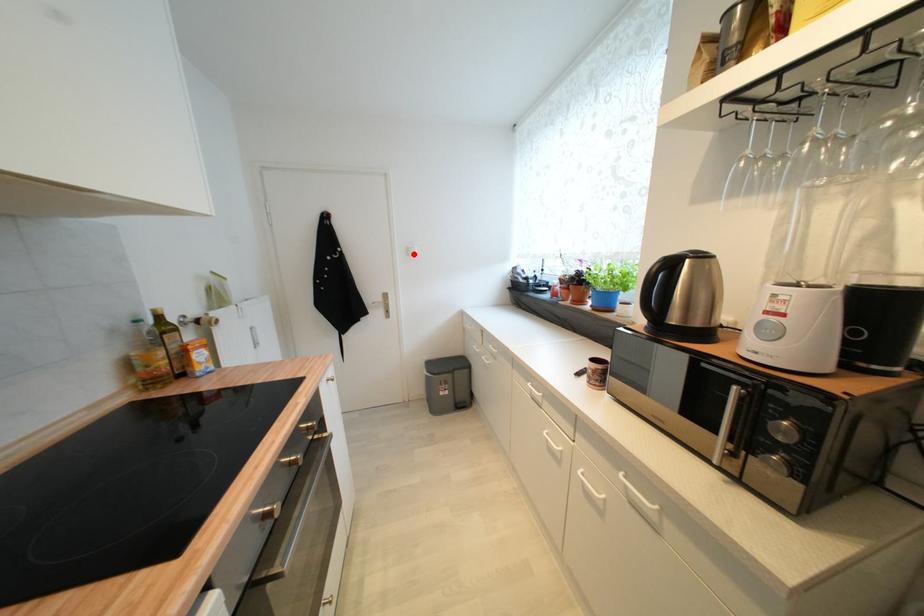
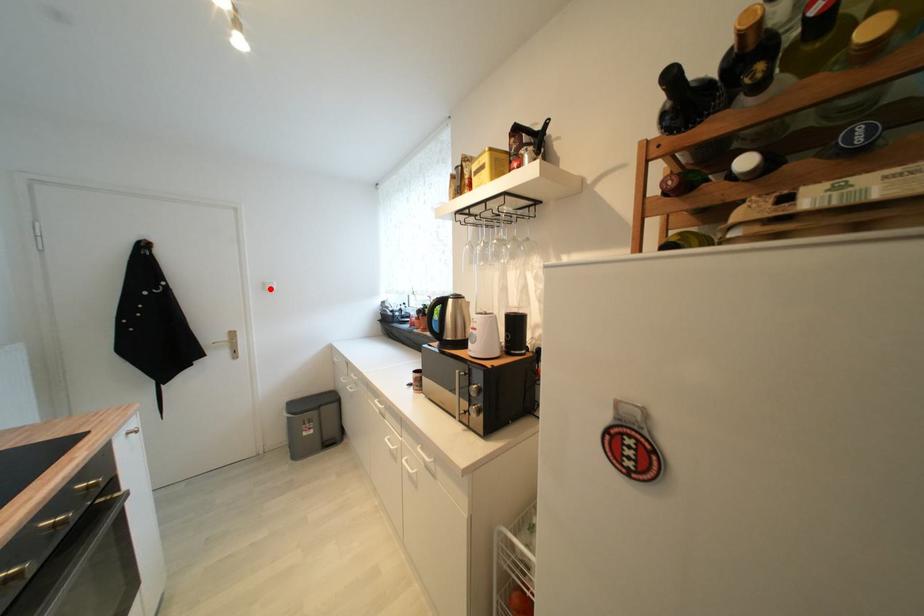
I am providing you with two images of the same scene from different viewpoints. A red point is marked on the first image and another point is marked on the second image. Is the red point in image1 aligned with the point shown in image2?

Yes